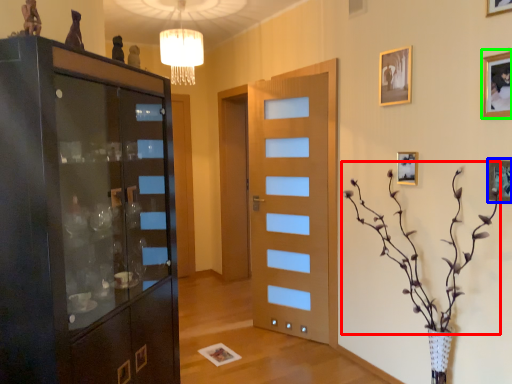
Question: Estimate the real-world distances between objects in this image. Which object is closer to floral arrangement (highlighted by a red box), picture frame (highlighted by a blue box) or picture frame (highlighted by a green box)?

Choices:
 (A) picture frame
 (B) picture frame

Answer: (A)